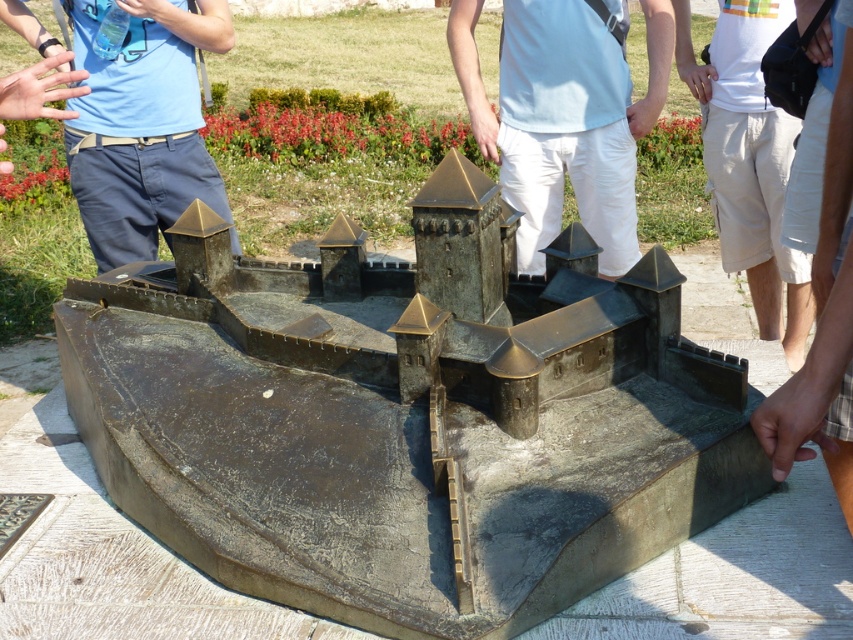
You are a visitor at an outdoor exhibition and see the bronze sculpture at center and the white matte pants at center. Which object takes up more space in the image?

The bronze sculpture at center is bigger than the white matte pants at center, so it takes up more space in the image.

Looking at this image, where is the bronze sculpture at center located in the image? Please provide coordinates in the format of a point like this example format for reference only, not part of the answer. The answer should be in the form of a point like this example format for reference only, not part of the the answer. The answer should be in the form of a point like this example format for reference only, not part of the answer. The answer should be in the form of a point like this example format for reference only, not part.

The bronze sculpture at center is located at point coordinates of (405, 419).